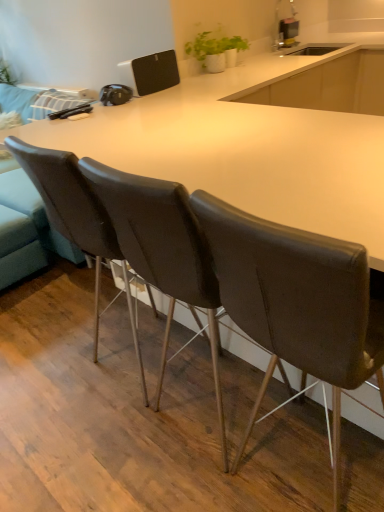
Question: Is leather at left, the 3th chair when ordered from right to left, inside the boundaries of white matte pot at upper center, or outside?

Choices:
 (A) outside
 (B) inside

Answer: (A)

Question: Is point (74, 181) closer or farther from the camera than point (225, 47)?

Choices:
 (A) closer
 (B) farther

Answer: (A)

Question: Which of these objects is positioned farthest from the leather at center, the 2th chair positioned from the right?

Choices:
 (A) white matte pot at upper center
 (B) brown leather chair at center, which is counted as the first chair, starting from the right
 (C) leather at left, which appears as the 1th chair when viewed from the left
 (D) metallic silver toaster at upper center

Answer: (D)

Question: Which object is positioned farthest from the brown leather chair at center, which is counted as the first chair, starting from the right?

Choices:
 (A) leather at center, the 2th chair positioned from the right
 (B) metallic silver toaster at upper center
 (C) leather at left, the 3th chair when ordered from right to left
 (D) white matte pot at upper center

Answer: (B)